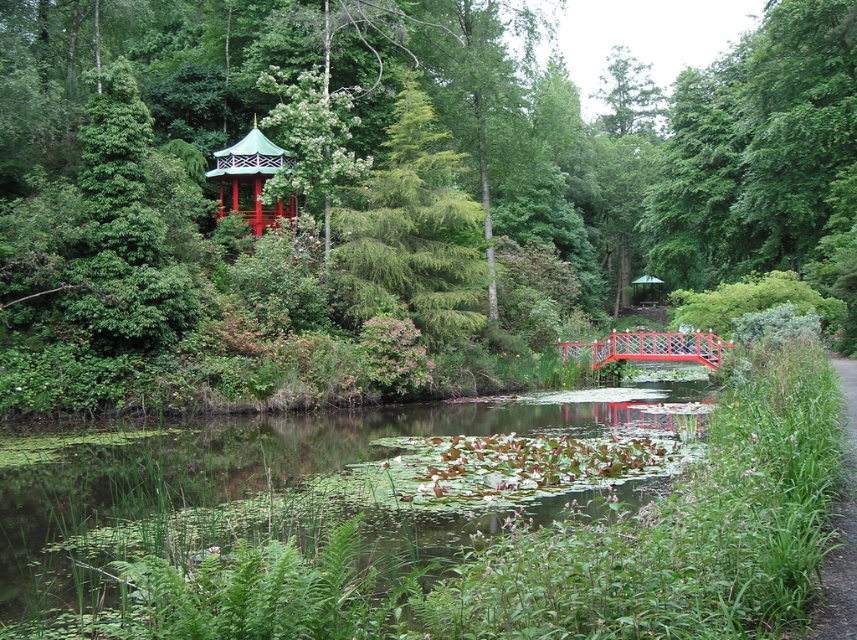
Question: Does green glossy pagoda at upper center have a larger size compared to green textured pine tree at center?

Choices:
 (A) no
 (B) yes

Answer: (B)

Question: Which of the following is the closest to the observer?

Choices:
 (A) (214, 161)
 (B) (609, 333)
 (C) (566, 436)
 (D) (825, 563)

Answer: (D)

Question: Which point is farther to the camera?

Choices:
 (A) (216, 538)
 (B) (645, 339)

Answer: (B)

Question: In this image, where is green matte gazebo at upper center located relative to metallic red bridge at center?

Choices:
 (A) above
 (B) below

Answer: (A)

Question: Which point appears farthest from the camera in this image?

Choices:
 (A) (459, 220)
 (B) (279, 214)
 (C) (649, 339)
 (D) (531, 444)

Answer: (B)

Question: Is green leafy water at center to the left of green textured pine tree at center from the viewer's perspective?

Choices:
 (A) no
 (B) yes

Answer: (B)